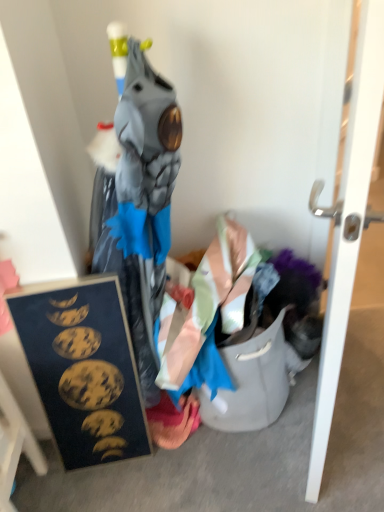
Identify the location of unoccupied region to the right of white glossy door at right. (359, 378).